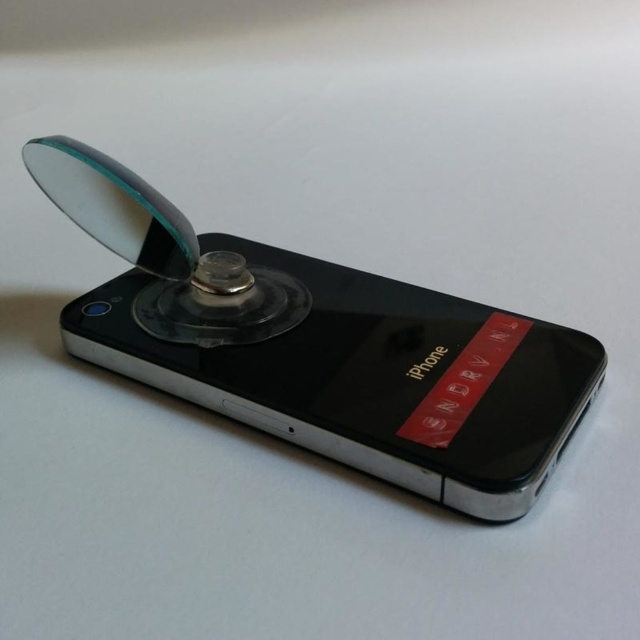
Question: Does black glossy iphone at center have a lesser width compared to transparent plastic magnifying glass at upper center?

Choices:
 (A) no
 (B) yes

Answer: (A)

Question: Which point is closer to the camera?

Choices:
 (A) (266, 282)
 (B) (182, 371)

Answer: (B)

Question: Does black glossy iphone at center appear on the left side of transparent plastic magnifying glass at upper center?

Choices:
 (A) yes
 (B) no

Answer: (B)

Question: Which point is farther to the camera?

Choices:
 (A) (198, 326)
 (B) (536, 436)

Answer: (A)

Question: Is black glossy iphone at center closer to camera compared to transparent plastic magnifying glass at upper center?

Choices:
 (A) yes
 (B) no

Answer: (A)

Question: Which point is closer to the camera?

Choices:
 (A) transparent plastic magnifying glass at upper center
 (B) black glossy iphone at center

Answer: (B)